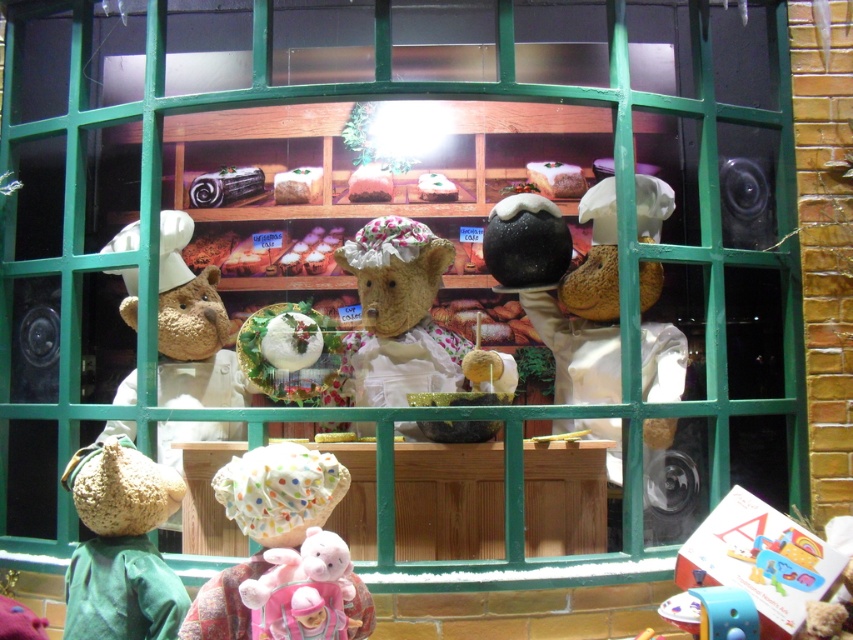
Is knitted green hat at lower left positioned before fluffy white teddy bear at center?

Yes, knitted green hat at lower left is in front of fluffy white teddy bear at center.

Is knitted green hat at lower left taller than fluffy white teddy bear at center?

No.

Describe the element at coordinates (120, 545) in the screenshot. The image size is (853, 640). I see `knitted green hat at lower left` at that location.

Find the location of `knitted green hat at lower left`. knitted green hat at lower left is located at coordinates (120, 545).

Does polka dot fabric hat at lower center lie in front of cardboard box at lower right?

Yes.

Consider the image. Who is taller, polka dot fabric hat at lower center or cardboard box at lower right?

With more height is polka dot fabric hat at lower center.

Find the location of a particular element. The height and width of the screenshot is (640, 853). polka dot fabric hat at lower center is located at coordinates (263, 524).

Find the location of a particular element. polka dot fabric hat at lower center is located at coordinates (263, 524).

Does knitted green hat at lower left come behind polka dot fabric hat at lower center?

Yes.

Can you confirm if knitted green hat at lower left is positioned to the left of polka dot fabric hat at lower center?

Correct, you'll find knitted green hat at lower left to the left of polka dot fabric hat at lower center.

Describe the element at coordinates (120, 545) in the screenshot. I see `knitted green hat at lower left` at that location.

Locate an element on the screen. The height and width of the screenshot is (640, 853). knitted green hat at lower left is located at coordinates (120, 545).